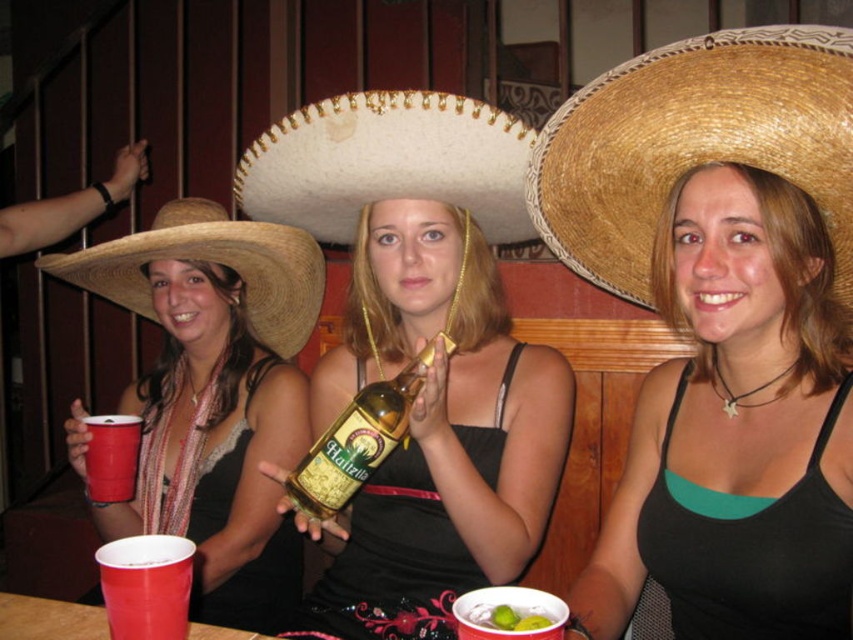
You are at a party and want to place a decorative item between the black matte tank top at center and the matte straw sombrero at upper left. Which object should you place closer to the edge of the table to ensure it doesn

The black matte tank top at center has a lesser width compared to the matte straw sombrero at upper left, so you should place the decorative item closer to the edge of the table near the matte straw sombrero at upper left to maintain balance.